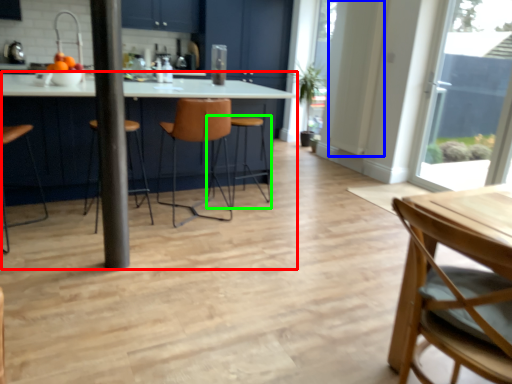
Question: Which is farther away from kitchen & dining room table (highlighted by a red box)? door (highlighted by a blue box) or bar stool (highlighted by a green box)?

Choices:
 (A) door
 (B) bar stool

Answer: (A)